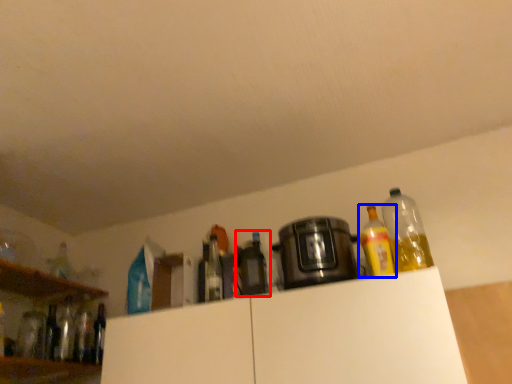
Question: Which point is closer to the camera, bottle (highlighted by a red box) or bottle (highlighted by a blue box)?

Choices:
 (A) bottle
 (B) bottle

Answer: (B)